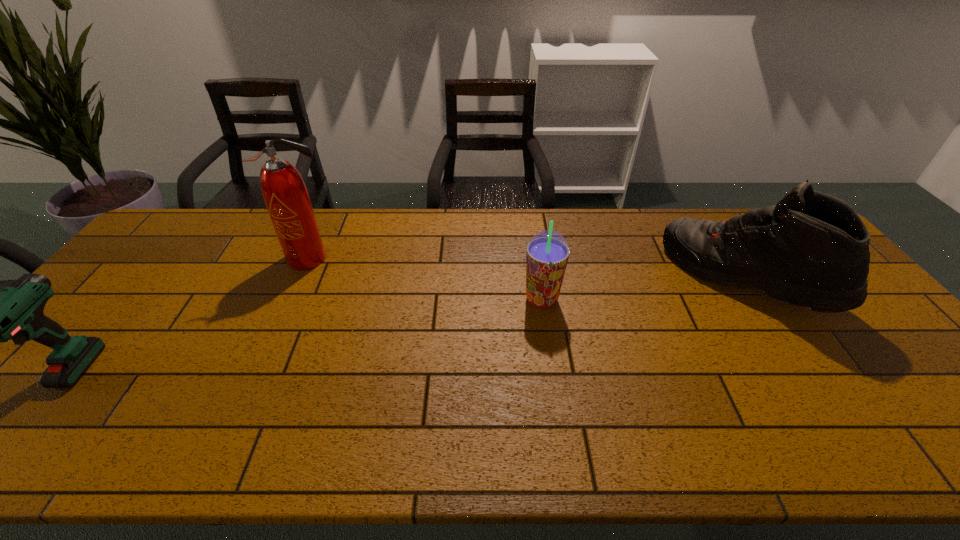
The image size is (960, 540). I want to click on free space between the second tallest object and the smoothie, so click(643, 288).

Select which object appears as the second closest to the ski boot. Please provide its 2D coordinates. Your answer should be formatted as a tuple, i.e. [(x, y)], where the tuple contains the x and y coordinates of a point satisfying the conditions above.

[(284, 192)]

This screenshot has height=540, width=960. In order to click on object that is the second nearest to the nearest object in this screenshot , I will do `click(547, 254)`.

At what (x,y) coordinates should I click in order to perform the action: click on free space that satisfies the following two spatial constraints: 1. on the back side of the rightmost object; 2. on the left side of the smoothie. Please return your answer as a coordinate pair (x, y). The width and height of the screenshot is (960, 540). Looking at the image, I should click on (539, 278).

This screenshot has width=960, height=540. I want to click on free spot that satisfies the following two spatial constraints: 1. on the front side of the rightmost object; 2. on the left side of the tallest object, so click(x=300, y=278).